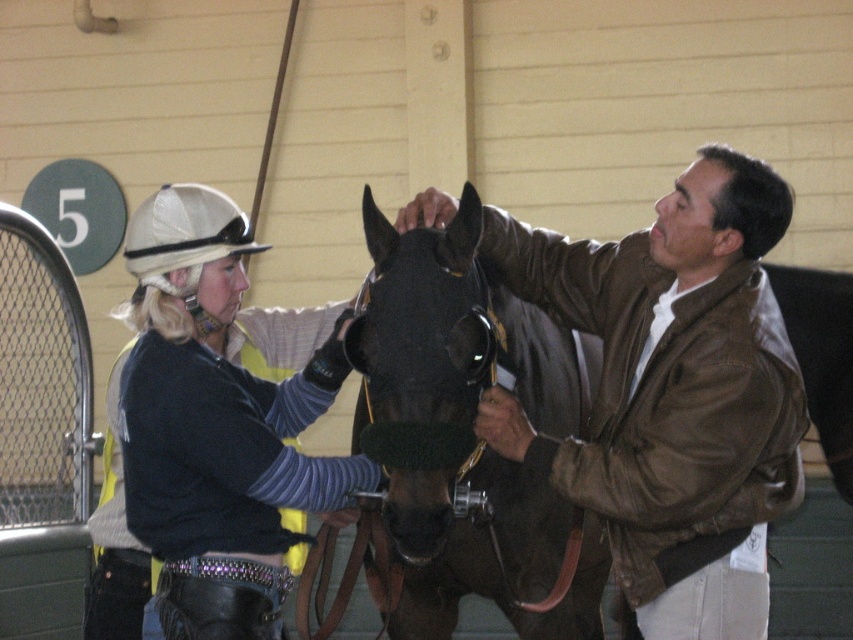
Question: Is shiny black horse at center to the left of matte black helmet at upper left from the viewer's perspective?

Choices:
 (A) yes
 (B) no

Answer: (B)

Question: Is brown leather jacket at center positioned behind matte black helmet at upper left?

Choices:
 (A) yes
 (B) no

Answer: (A)

Question: Which is farther from the shiny black horse at center?

Choices:
 (A) brown leather jacket at center
 (B) matte black helmet at upper left

Answer: (A)

Question: Which point is farther to the camera?

Choices:
 (A) brown leather jacket at center
 (B) matte black helmet at upper left

Answer: (A)

Question: Which point is closer to the camera?

Choices:
 (A) (285, 467)
 (B) (523, 337)

Answer: (A)

Question: Is shiny black horse at center positioned in front of matte black helmet at upper left?

Choices:
 (A) yes
 (B) no

Answer: (B)